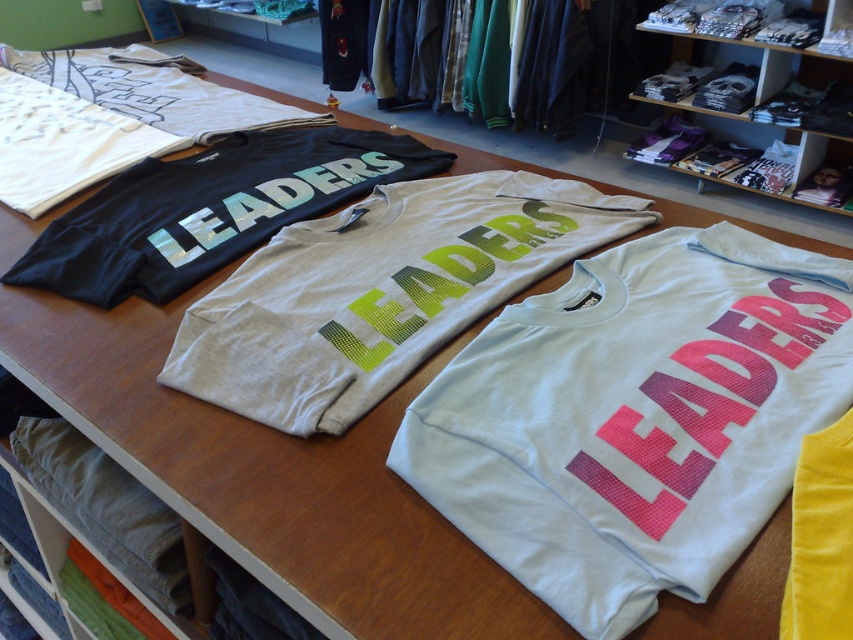
Question: Estimate the real-world distances between objects in this image. Which object is farther from the yellow cotton t-shirt at center?

Choices:
 (A) white matte t-shirt at center
 (B) black matte t-shirt at center
 (C) white cotton t-shirt at center

Answer: (B)

Question: Does white cotton t-shirt at center appear under denim pants at lower left?

Choices:
 (A) yes
 (B) no

Answer: (B)

Question: Does denim pants at lower left appear under yellow cotton t-shirt at center?

Choices:
 (A) yes
 (B) no

Answer: (A)

Question: Which point is closer to the camera?

Choices:
 (A) black matte t-shirt at center
 (B) yellow cotton t-shirt at center
 (C) white cotton t-shirt at center
 (D) white matte t-shirt at center

Answer: (B)

Question: Is white cotton t-shirt at center bigger than yellow cotton t-shirt at center?

Choices:
 (A) no
 (B) yes

Answer: (B)

Question: Which object is farther from the camera taking this photo?

Choices:
 (A) white matte t-shirt at center
 (B) white cotton t-shirt at center

Answer: (B)